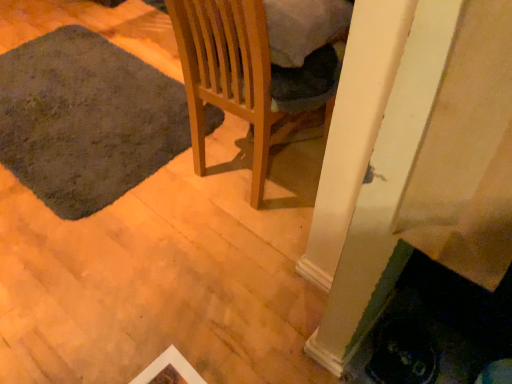
Question: Considering the relative sizes of dark gray carpet at lower left and wooden chair at center in the image provided, is dark gray carpet at lower left shorter than wooden chair at center?

Choices:
 (A) yes
 (B) no

Answer: (A)

Question: Does dark gray carpet at lower left appear on the left side of wooden chair at center?

Choices:
 (A) no
 (B) yes

Answer: (B)

Question: From a real-world perspective, is dark gray carpet at lower left over wooden chair at center?

Choices:
 (A) no
 (B) yes

Answer: (A)

Question: Considering the relative sizes of dark gray carpet at lower left and wooden chair at center in the image provided, is dark gray carpet at lower left thinner than wooden chair at center?

Choices:
 (A) yes
 (B) no

Answer: (B)

Question: Can you confirm if dark gray carpet at lower left is bigger than wooden chair at center?

Choices:
 (A) no
 (B) yes

Answer: (A)

Question: From the image's perspective, does dark gray carpet at lower left appear lower than wooden chair at center?

Choices:
 (A) no
 (B) yes

Answer: (A)

Question: From a real-world perspective, is wooden chair at center located beneath dark gray carpet at lower left?

Choices:
 (A) no
 (B) yes

Answer: (A)

Question: Is wooden chair at center taller than dark gray carpet at lower left?

Choices:
 (A) yes
 (B) no

Answer: (A)

Question: Is wooden chair at center turned away from dark gray carpet at lower left?

Choices:
 (A) yes
 (B) no

Answer: (B)

Question: Could you tell me if wooden chair at center is facing dark gray carpet at lower left?

Choices:
 (A) yes
 (B) no

Answer: (B)

Question: Can you confirm if wooden chair at center is wider than dark gray carpet at lower left?

Choices:
 (A) no
 (B) yes

Answer: (A)

Question: Is wooden chair at center not near dark gray carpet at lower left?

Choices:
 (A) no
 (B) yes

Answer: (A)

Question: In terms of height, does wooden chair at center look taller or shorter compared to dark gray carpet at lower left?

Choices:
 (A) short
 (B) tall

Answer: (B)